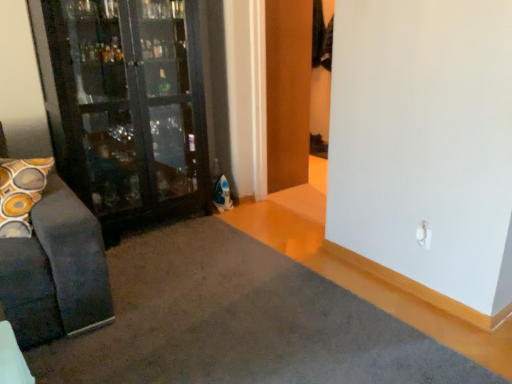
Question: Relative to gray carpet at lower left, is wooden door at center in front or behind?

Choices:
 (A) front
 (B) behind

Answer: (B)

Question: Based on their positions, is wooden door at center located to the left or right of gray carpet at lower left?

Choices:
 (A) right
 (B) left

Answer: (A)

Question: From a real-world perspective, relative to gray carpet at lower left, is wooden door at center vertically above or below?

Choices:
 (A) below
 (B) above

Answer: (B)

Question: From a real-world perspective, relative to wooden door at center, is gray carpet at lower left vertically above or below?

Choices:
 (A) above
 (B) below

Answer: (B)

Question: Based on their sizes in the image, would you say gray carpet at lower left is bigger or smaller than wooden door at center?

Choices:
 (A) big
 (B) small

Answer: (B)

Question: Is point (169, 228) positioned closer to the camera than point (279, 142)?

Choices:
 (A) farther
 (B) closer

Answer: (B)

Question: In the image, is gray carpet at lower left positioned in front of or behind wooden door at center?

Choices:
 (A) front
 (B) behind

Answer: (A)